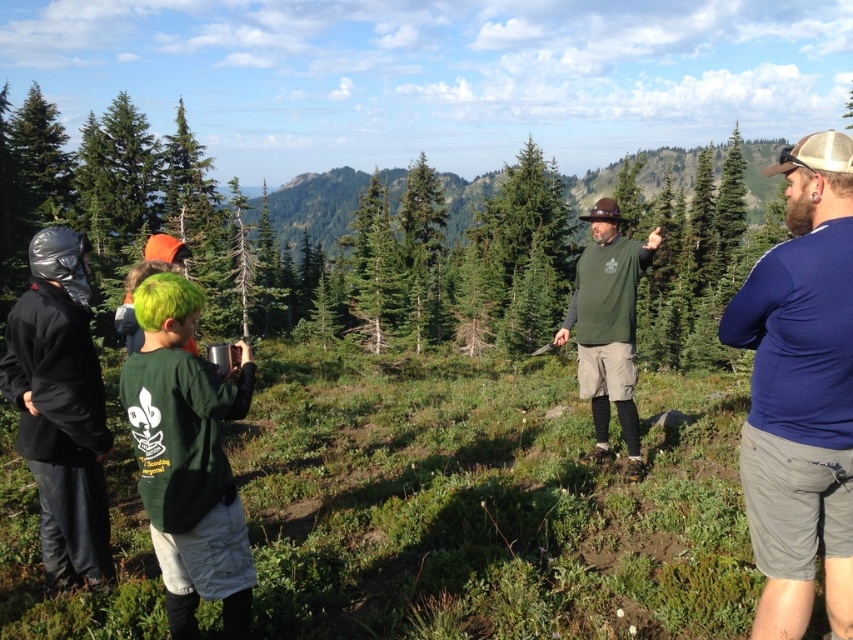
You are organizing a group photo and need to arrange the green matte shirt at lower left and the black matte jacket at left in a row. If the total width available is exactly the combined width of both, will there be any space left after placing them side by side?

The green matte shirt at lower left might be wider than black matte jacket at left, so there might not be enough space if the shirt is wider, leaving no space or possibly requiring adjustment.

You are standing at the point labeled as point (57, 256) and want to walk towards the point labeled as point (170, 529). Will you be moving forward or backward relative to your current position?

Since point (170, 529) is in front of point (57, 256), moving towards it would mean you are moving forward relative to your current position at point (57, 256).